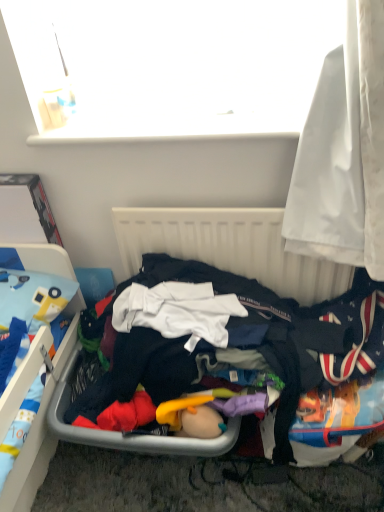
Question: From a real-world perspective, is white plastic radiator at center above or below white fabric curtain at right?

Choices:
 (A) below
 (B) above

Answer: (A)

Question: Is white plastic radiator at center wider or thinner than white fabric curtain at right?

Choices:
 (A) wide
 (B) thin

Answer: (B)

Question: Which object is positioned closest to the white fabric curtain at right?

Choices:
 (A) white plastic radiator at center
 (B) dark blue fabric at center

Answer: (A)

Question: Which is farther from the white plastic radiator at center?

Choices:
 (A) white fabric curtain at right
 (B) dark blue fabric at center

Answer: (A)